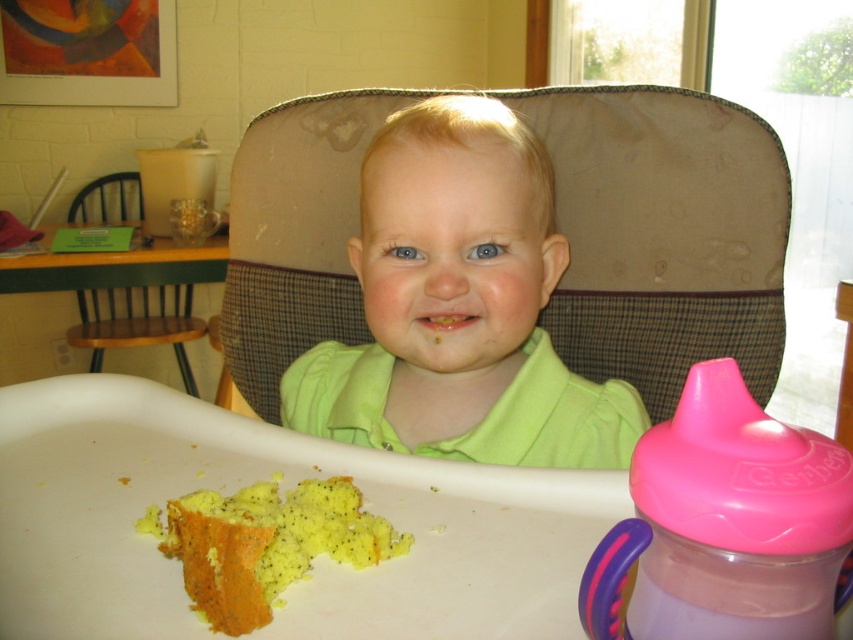
Does pink plastic sippy cup at right have a greater width compared to wooden chair at left?

Incorrect, pink plastic sippy cup at right's width does not surpass wooden chair at left's.

Is pink plastic sippy cup at right above wooden chair at left?

No, pink plastic sippy cup at right is not above wooden chair at left.

Who is more forward, [695,477] or [119,289]?

Point [695,477] is more forward.

Where is `pink plastic sippy cup at right`? The image size is (853, 640). pink plastic sippy cup at right is located at coordinates (727, 522).

Does point (579, 592) lie in front of point (186, 525)?

Yes, it is.

Between point (836, 442) and point (276, 573), which one is positioned in front?

Positioned in front is point (276, 573).

Is point (703, 472) closer to viewer compared to point (268, 532)?

Yes, it is.

Locate an element on the screen. The width and height of the screenshot is (853, 640). pink plastic sippy cup at right is located at coordinates click(727, 522).

Who is more forward, (401,230) or (709,410)?

Positioned in front is point (709,410).

Between point (344, 387) and point (660, 461), which one is positioned behind?

Point (344, 387)

Image resolution: width=853 pixels, height=640 pixels. Describe the element at coordinates (459, 307) in the screenshot. I see `green matte shirt at center` at that location.

What are the coordinates of `green matte shirt at center` in the screenshot? It's located at (459, 307).